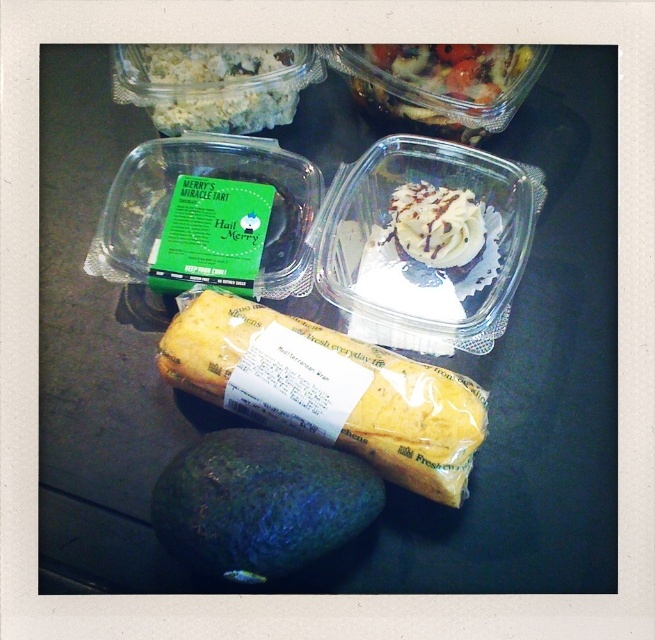
Looking at this image, you are a food critic who needs to describe the arrangement of the shiny plastic salad at upper center and the white crumbly rice at upper left. Which one takes up more space in the image?

The shiny plastic salad at upper center is bigger than the white crumbly rice at upper left, so it takes up more space in the image.